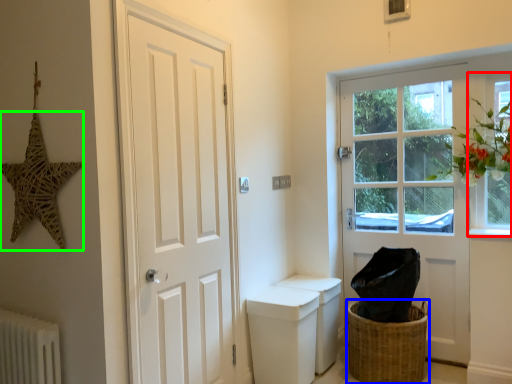
Question: Estimate the real-world distances between objects in this image. Which object is closer to window (highlighted by a red box), basket (highlighted by a blue box) or star (highlighted by a green box)?

Choices:
 (A) basket
 (B) star

Answer: (A)